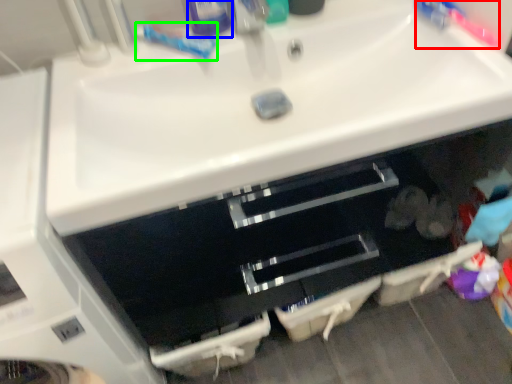
Question: Based on their relative distances, which object is farther from toothbrush (highlighted by a red box)? Choose from toiletry (highlighted by a blue box) and toothpaste (highlighted by a green box).

Choices:
 (A) toiletry
 (B) toothpaste

Answer: (B)